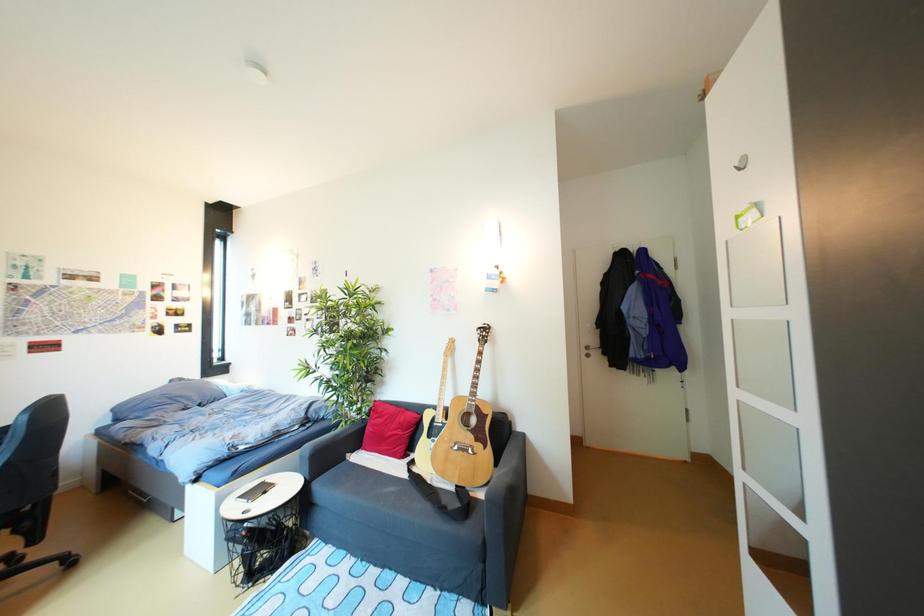
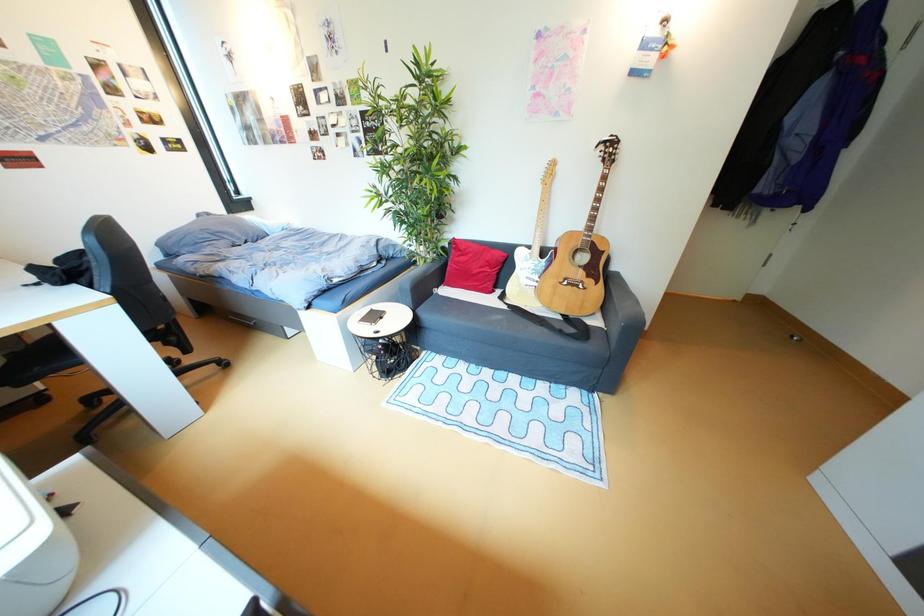
Question: Based on the continuous images, in which direction is the camera rotating? Reply with the corresponding letter.

Choices:
 (A) Left
 (B) Right
 (C) Up
 (D) Down

Answer: (D)